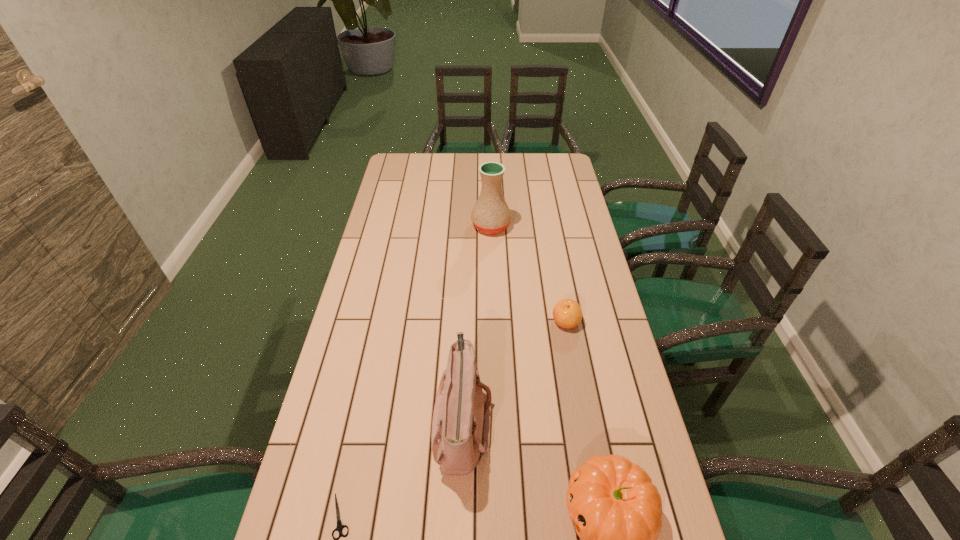
Identify the location of blank space at the left edge of the desktop. The width and height of the screenshot is (960, 540). (384, 218).

Image resolution: width=960 pixels, height=540 pixels. In order to click on vacant space at the right edge of the desktop in this screenshot , I will do `click(553, 207)`.

In the image, there is a desktop. At what (x,y) coordinates should I click in order to perform the action: click on vacant space at the far left corner. Please return your answer as a coordinate pair (x, y). This screenshot has width=960, height=540. Looking at the image, I should click on (420, 163).

What are the coordinates of `blank region between the shoulder bag and the fourth tallest object` in the screenshot? It's located at (514, 371).

Identify the location of free spot between the fourth tallest object and the fourth shortest object. (514, 371).

What are the coordinates of `blank region between the pottery and the fourth tallest object` in the screenshot? It's located at (528, 274).

The height and width of the screenshot is (540, 960). I want to click on object that stands as the third closest to the shoulder bag, so click(x=567, y=313).

The width and height of the screenshot is (960, 540). Identify the location of object that is the second closest to the fourth shortest object. (340, 526).